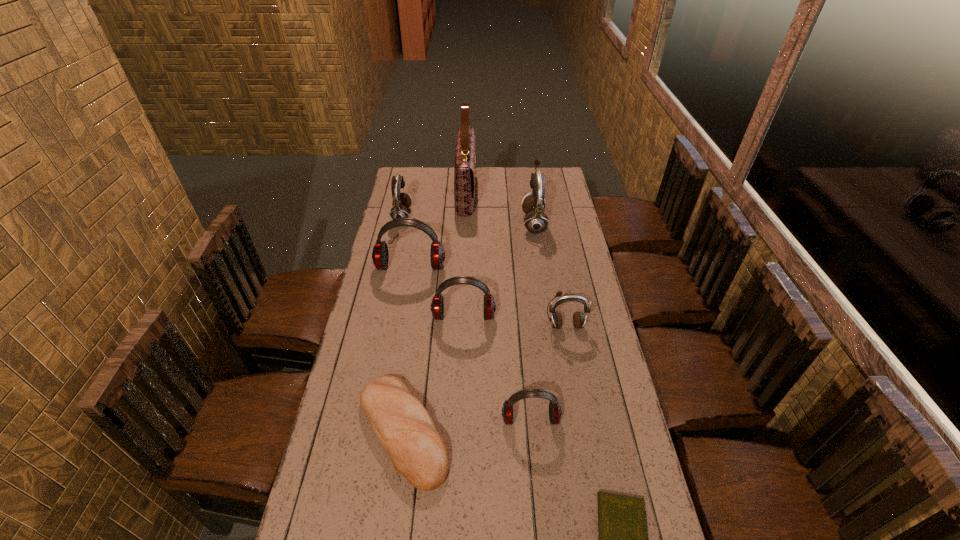
The width and height of the screenshot is (960, 540). Find the location of `blank region between the tallest object and the second tallest object`. blank region between the tallest object and the second tallest object is located at coordinates (500, 208).

Identify the location of vacant point located between the tallest earphone and the leftmost brown earphone. (468, 219).

Where is `vacant space that is in between the second biggest brown earphone and the handbag`? Image resolution: width=960 pixels, height=540 pixels. vacant space that is in between the second biggest brown earphone and the handbag is located at coordinates (434, 204).

Find the location of a particular element. This screenshot has width=960, height=540. free space between the bread and the sixth nearest object is located at coordinates (407, 349).

You are a GUI agent. You are given a task and a screenshot of the screen. Output one action in this format:
    pyautogui.click(x=<x>, y=<y>)
    Task: Click on the blank region between the second smallest brown earphone and the brown handbag
    The height and width of the screenshot is (540, 960).
    Given the screenshot: What is the action you would take?
    pyautogui.click(x=434, y=204)

Identify the location of free space between the second biggest red earphone and the nearest brown earphone. The height and width of the screenshot is (540, 960). (515, 321).

Select which object is the fifth closest to the second nearest red earphone. Please provide its 2D coordinates. Your answer should be formatted as a tuple, i.e. [(x, y)], where the tuple contains the x and y coordinates of a point satisfying the conditions above.

[(533, 206)]

Locate an element on the screen. The height and width of the screenshot is (540, 960). object that is the fourth closest one to the eighth shortest object is located at coordinates (556, 319).

Find the location of a particular element. The width and height of the screenshot is (960, 540). earphone that is the fifth nearest to the nearest brown earphone is located at coordinates (401, 202).

Locate which earphone ranks second in proximity to the second tallest object. Please provide its 2D coordinates. Your answer should be formatted as a tuple, i.e. [(x, y)], where the tuple contains the x and y coordinates of a point satisfying the conditions above.

[(437, 306)]